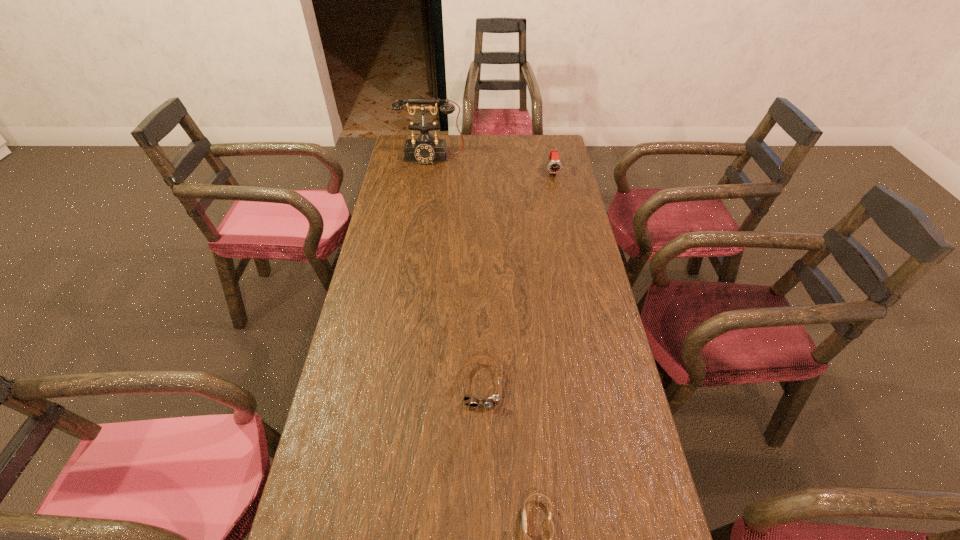
Find the location of `free space between the right watch and the third farthest object`. free space between the right watch and the third farthest object is located at coordinates (517, 278).

Locate an element on the screen. The image size is (960, 540). free area in between the telephone and the goggles is located at coordinates (456, 271).

I want to click on object that can be found as the third closest to the third farthest object, so click(425, 149).

Where is `object that stands as the third closest to the third object from right to left`? The height and width of the screenshot is (540, 960). object that stands as the third closest to the third object from right to left is located at coordinates (425, 149).